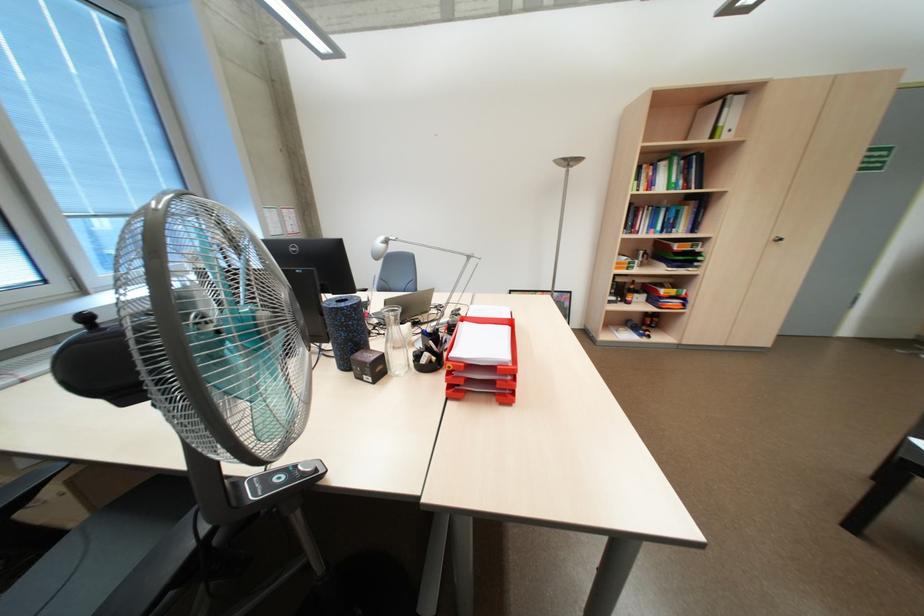
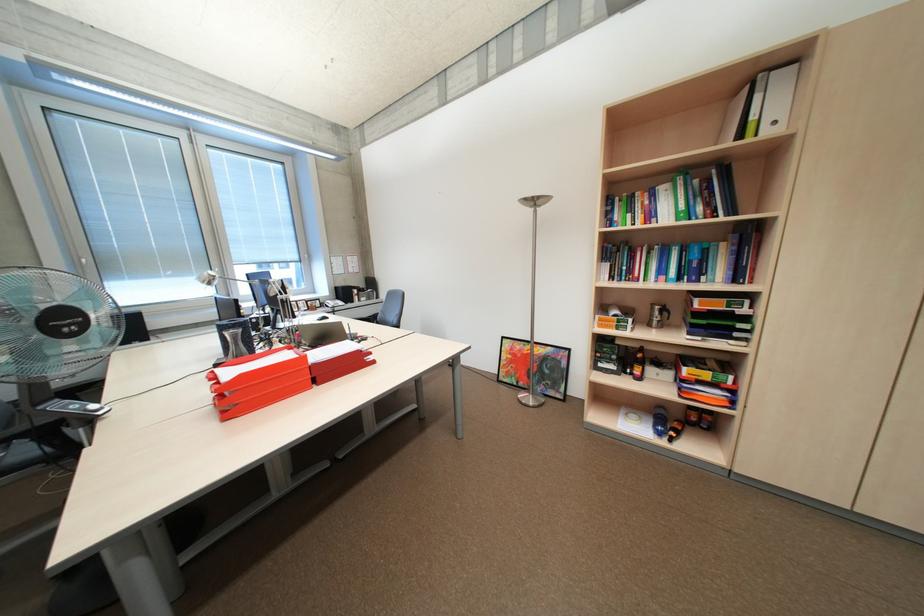
Where in the second image is the point corresponding to point 682,214 from the first image?

(704, 254)